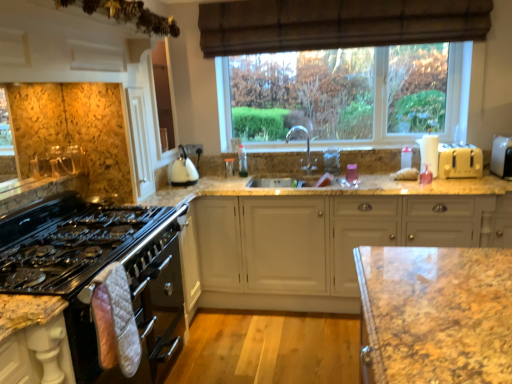
How much space does white plastic toaster at right, positioned as the first appliance in right-to-left order, occupy vertically?

white plastic toaster at right, positioned as the first appliance in right-to-left order, is 11.43 inches tall.

What do you see at coordinates (459, 161) in the screenshot? The width and height of the screenshot is (512, 384). I see `white plastic toaster at right, the first appliance viewed from the left` at bounding box center [459, 161].

What is the approximate height of silver metallic faucet at center?

36.98 centimeters.

You are a GUI agent. You are given a task and a screenshot of the screen. Output one action in this format:
    pyautogui.click(x=<x>, y=<y>)
    Task: Click on the black glass oven at left
    This screenshot has height=384, width=512.
    Given the screenshot: What is the action you would take?
    pyautogui.click(x=138, y=316)

Locate an element on the screen. The width and height of the screenshot is (512, 384). pink quilted oven mitt at lower left is located at coordinates (115, 321).

Is white glossy kettle at upper center located outside brown textured curtain at upper center?

Yes, white glossy kettle at upper center is not within brown textured curtain at upper center.

What's the angular difference between white glossy kettle at upper center and brown textured curtain at upper center's facing directions?

90.6 degrees.

Does white glossy kettle at upper center lie behind brown textured curtain at upper center?

Yes, the depth of white glossy kettle at upper center is greater than that of brown textured curtain at upper center.

Is white glossy kettle at upper center placed right next to silver metallic faucet at center?

They are not placed beside each other.

Is white glossy kettle at upper center shorter than silver metallic faucet at center?

Correct, white glossy kettle at upper center is not as tall as silver metallic faucet at center.

From the image's perspective, is white glossy kettle at upper center positioned above or below silver metallic faucet at center?

Clearly, from the image's perspective, white glossy kettle at upper center is below silver metallic faucet at center.

Does silver metallic faucet at center have a smaller size compared to black glass oven at left?

Correct, silver metallic faucet at center occupies less space than black glass oven at left.

Measure the distance from silver metallic faucet at center to black glass oven at left.

silver metallic faucet at center is 1.88 meters away from black glass oven at left.

Which object is wider, silver metallic faucet at center or black glass oven at left?

With larger width is black glass oven at left.

Would you say silver metallic faucet at center is outside black glass oven at left?

That's correct, silver metallic faucet at center is outside of black glass oven at left.

Are black glass oven at left and brown textured curtain at upper center far apart?

Yes, black glass oven at left and brown textured curtain at upper center are quite far apart.

Would you say black glass oven at left is inside or outside brown textured curtain at upper center?

black glass oven at left is located beyond the bounds of brown textured curtain at upper center.

Which is in front, point (234, 24) or point (372, 147)?

Positioned in front is point (234, 24).

Is brown textured curtain at upper center shorter than granite countertop at center?

No, brown textured curtain at upper center is not shorter than granite countertop at center.

Is brown textured curtain at upper center facing towards granite countertop at center?

No.

Find the location of a particular element. window sill beneath the brown textured curtain at upper center (from a real-world perspective) is located at coordinates (366, 145).

Consider the image. Which object is positioned more to the right, pink quilted oven mitt at lower left or white matte cabinet at center?

Positioned to the right is white matte cabinet at center.

Which of these two, pink quilted oven mitt at lower left or white matte cabinet at center, is wider?

white matte cabinet at center is wider.

From a real-world perspective, which is physically below, pink quilted oven mitt at lower left or white matte cabinet at center?

white matte cabinet at center is physically lower.

Which is in front, point (105, 309) or point (307, 244)?

The point (105, 309) is in front.

Is white matte cabinet at center to the left or to the right of white plastic toaster at right, which is the 2th appliance in left-to-right order, in the image?

From the image, it's evident that white matte cabinet at center is to the left of white plastic toaster at right, which is the 2th appliance in left-to-right order.

Is point (458, 197) positioned after point (503, 142)?

That is False.

Is white matte cabinet at center in front of or behind white plastic toaster at right, which is the 2th appliance in left-to-right order, in the image?

In the image, white matte cabinet at center appears in front of white plastic toaster at right, which is the 2th appliance in left-to-right order.

Is white plastic toaster at right, which is the 2th appliance in left-to-right order, surrounded by white matte cabinet at center?

Definitely not — white plastic toaster at right, which is the 2th appliance in left-to-right order, is not inside white matte cabinet at center.

Where is `curtain in front of the white glossy kettle at upper center`? This screenshot has width=512, height=384. curtain in front of the white glossy kettle at upper center is located at coordinates (337, 24).

Where is `tap above the white glossy kettle at upper center (from the image's perspective)`? tap above the white glossy kettle at upper center (from the image's perspective) is located at coordinates (306, 140).

Estimate the real-world distances between objects in this image. Which object is further from black glass oven at left, silver metallic faucet at center or white plastic toaster at right, which is the 2th appliance in left-to-right order?

white plastic toaster at right, which is the 2th appliance in left-to-right order, is further to black glass oven at left.

Based on their spatial positions, is silver metallic faucet at center or pink quilted oven mitt at lower left further from brown textured curtain at upper center?

Based on the image, pink quilted oven mitt at lower left appears to be further to brown textured curtain at upper center.

When comparing their distances from granite countertop at center, does white plastic toaster at right, positioned as the first appliance in right-to-left order, or brown textured curtain at upper center seem further?

white plastic toaster at right, positioned as the first appliance in right-to-left order.

From the picture: From the image, which object appears to be nearer to white glossy kettle at upper center, white plastic toaster at right, which is the 2th appliance in left-to-right order, or black glass gas stove at left?

Based on the image, black glass gas stove at left appears to be nearer to white glossy kettle at upper center.

Estimate the real-world distances between objects in this image. Which object is further from white plastic toaster at right, positioned as the first appliance in right-to-left order, black glass gas stove at left or pink quilted oven mitt at lower left?

black glass gas stove at left is positioned further to the anchor white plastic toaster at right, positioned as the first appliance in right-to-left order.

Which object lies further to the anchor point white matte cabinet at center, black glass oven at left or pink quilted oven mitt at lower left?

pink quilted oven mitt at lower left is further to white matte cabinet at center.

Based on their spatial positions, is granite countertop at center or white plastic toaster at right, positioned as the first appliance in right-to-left order, further from silver metallic faucet at center?

Among the two, white plastic toaster at right, positioned as the first appliance in right-to-left order, is located further to silver metallic faucet at center.

Looking at the image, which one is located further to black glass oven at left, white plastic toaster at right, which is the 2th appliance in left-to-right order, or black glass gas stove at left?

white plastic toaster at right, which is the 2th appliance in left-to-right order.

This screenshot has width=512, height=384. I want to click on tap situated between black glass gas stove at left and white matte cabinet at center from left to right, so click(x=306, y=140).

I want to click on material between white glossy kettle at upper center and white plastic toaster at right, which is the second appliance from right to left, in the horizontal direction, so click(x=115, y=321).

Identify the location of tap between black glass oven at left and granite countertop at center along the z-axis. Image resolution: width=512 pixels, height=384 pixels. (306, 140).

At what (x,y) coordinates should I click in order to perform the action: click on window sill between brown textured curtain at upper center and white matte cabinet at center in the vertical direction. Please return your answer as a coordinate pair (x, y). Looking at the image, I should click on (366, 145).